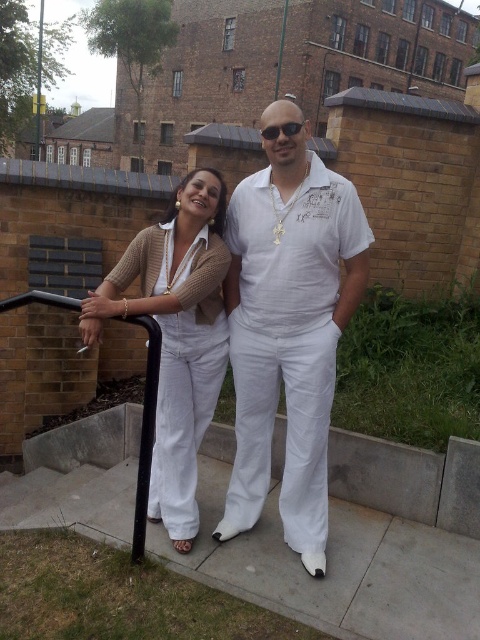
You are a photographer aiming to capture a portrait of the person wearing the white matte shirt at center. Given their current position at point 0.520, 0.602, where should you position your camera to ensure they are centered in the frame?

To center the person wearing the white matte shirt at center in the frame, position the camera at point (x=288, y=332), which is their current location.

You are a photographer setting up a shot of the two people in the scene. The matte white jumpsuit at center and the black plastic sunglasses at center are both in your frame. Based on their sizes, which object would you focus on first if you want to emphasize the larger subject?

The matte white jumpsuit at center has a greater height compared to the black plastic sunglasses at center, so you should focus on the matte white jumpsuit at center first to emphasize the larger subject.